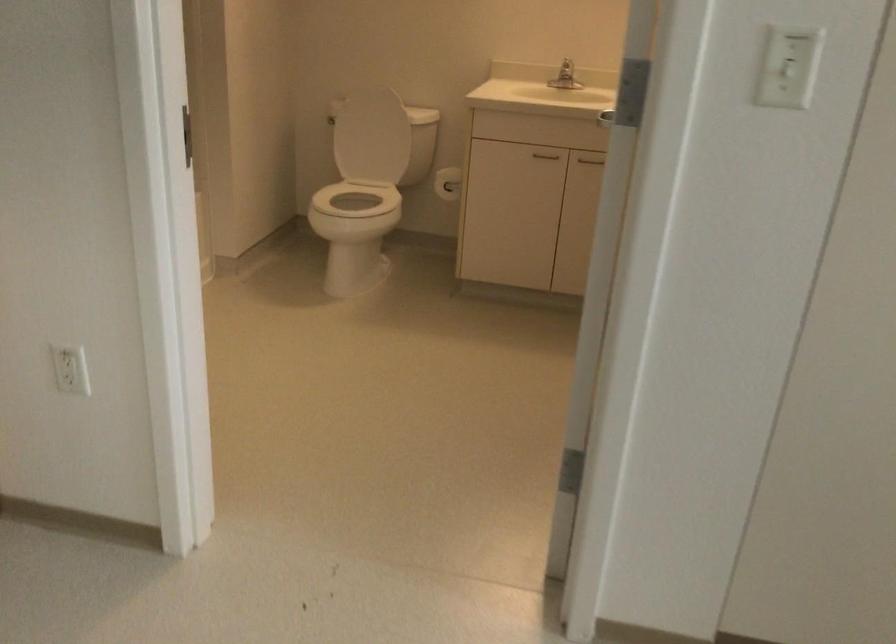
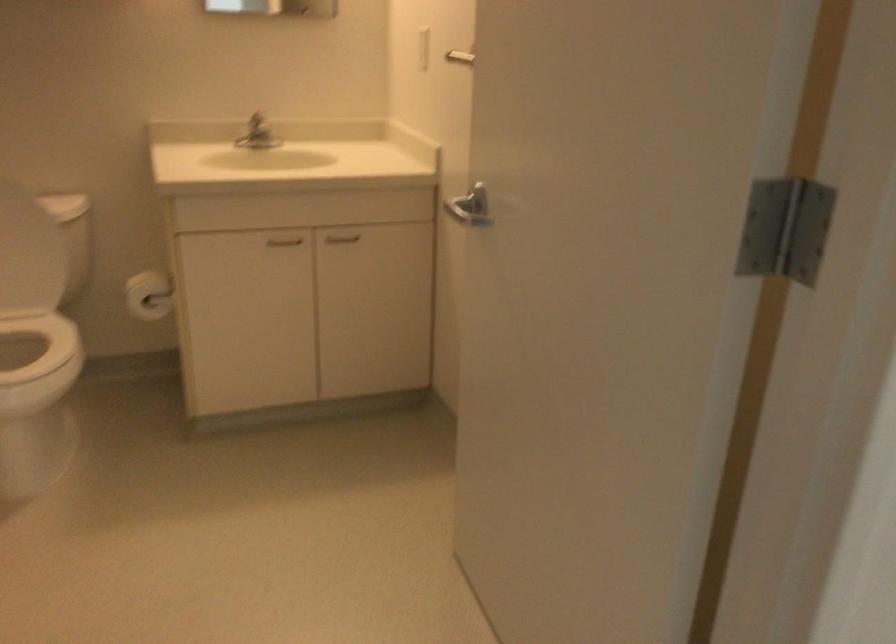
Where in the second image is the point corresponding to the point at 558,77 from the first image?

(255, 133)